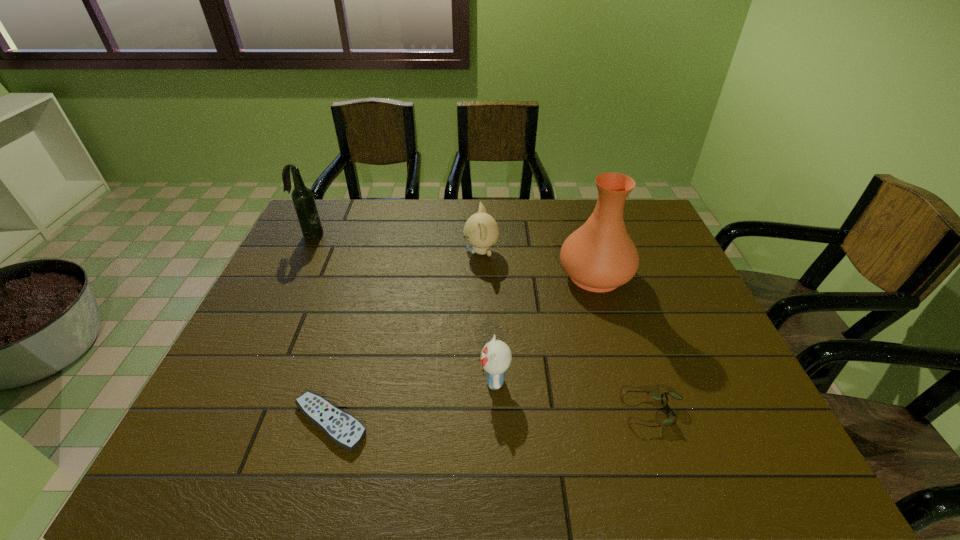
Identify the location of the tallest object. (600, 256).

The height and width of the screenshot is (540, 960). I want to click on beer bottle, so click(x=303, y=199).

Locate an element on the screen. the second tallest object is located at coordinates (303, 199).

Image resolution: width=960 pixels, height=540 pixels. I want to click on the farther kitten, so click(x=481, y=231).

Locate an element on the screen. This screenshot has height=540, width=960. the fourth tallest object is located at coordinates (496, 356).

Image resolution: width=960 pixels, height=540 pixels. I want to click on the nearer kitten, so click(496, 356).

I want to click on spectacles, so click(x=671, y=416).

Image resolution: width=960 pixels, height=540 pixels. I want to click on the shortest object, so click(342, 428).

Where is `the second object from left to right`? This screenshot has width=960, height=540. the second object from left to right is located at coordinates (342, 428).

I want to click on free region located 0.070m on the left of the tallest object, so click(x=534, y=275).